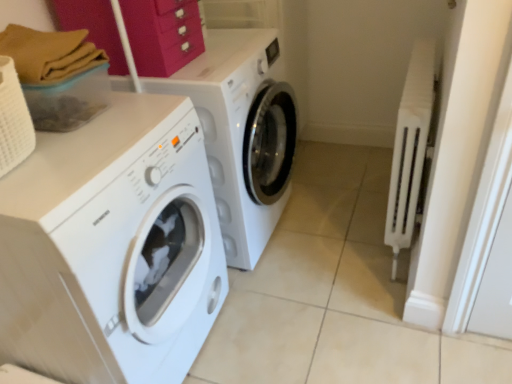
Question: From a real-world perspective, is white plastic radiator at right positioned above or below matte pink drawer at upper center?

Choices:
 (A) below
 (B) above

Answer: (A)

Question: Would you say white plastic radiator at right is to the left or to the right of matte pink drawer at upper center in the picture?

Choices:
 (A) left
 (B) right

Answer: (B)

Question: Which is nearer to the white glossy washing machine at left, which is counted as the 1th washing machine, starting from the front?

Choices:
 (A) matte pink drawer at upper center
 (B) white glossy washing machine at center, positioned as the second washing machine in front-to-back order
 (C) white plastic radiator at right

Answer: (B)

Question: Which object is the closest to the white glossy washing machine at center, the 1th washing machine positioned from the back?

Choices:
 (A) white plastic radiator at right
 (B) matte pink drawer at upper center
 (C) white glossy washing machine at left, which is counted as the 1th washing machine, starting from the front

Answer: (B)